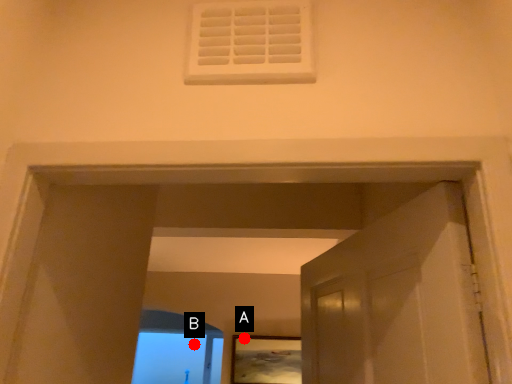
Question: Two points are circled on the image, labeled by A and B beside each circle. Which point is closer to the camera?

Choices:
 (A) A is closer
 (B) B is closer

Answer: (A)